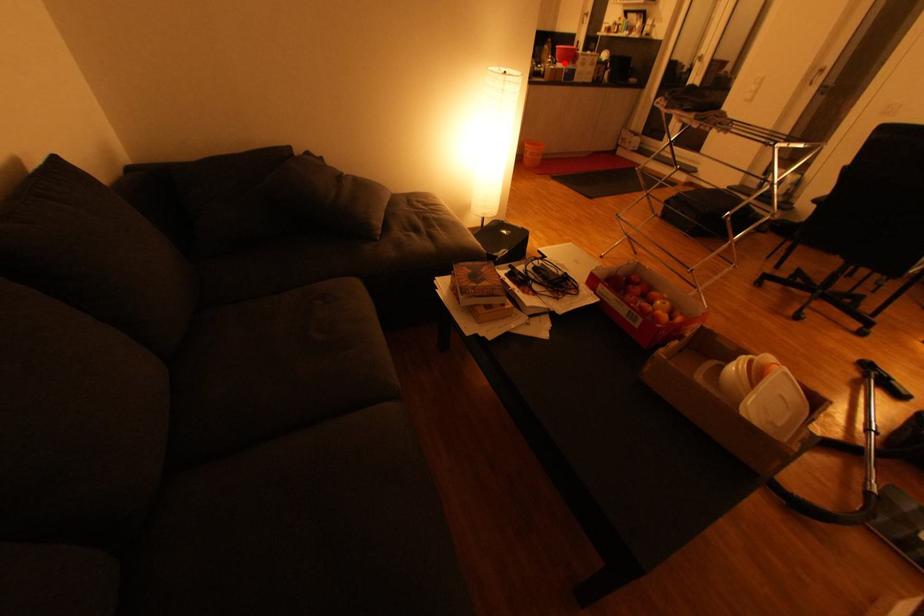
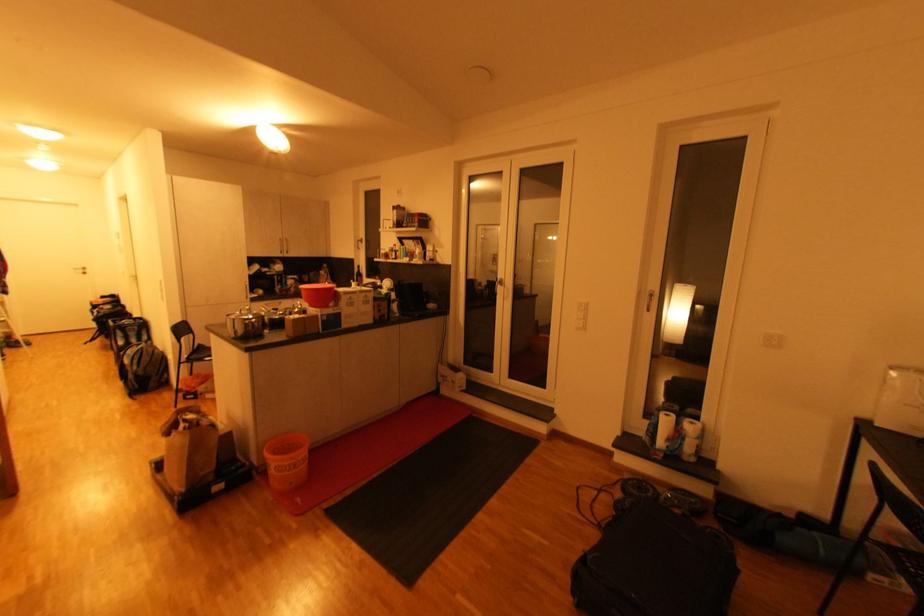
Question: I am providing you with two images of the same scene from different viewpoints. Given a red point in image1, look at the same physical point in image2. Is it:

Choices:
 (A) Closer to the viewpoint
 (B) Farther from the viewpoint

Answer: (B)